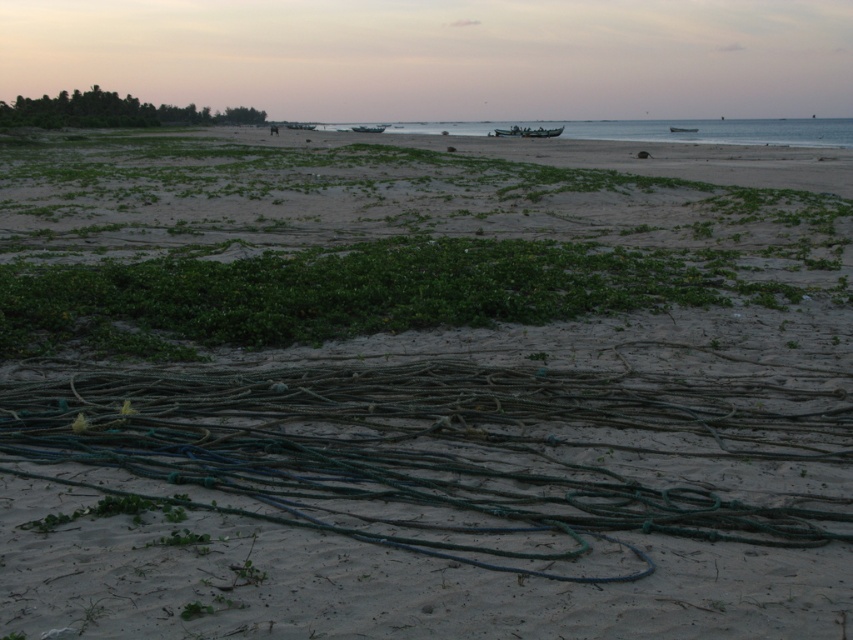
Consider the image. You are standing on the beach and see the green rubber rope at lower center and the green leafy vegetation at upper left. Which object is taller?

The green leafy vegetation at upper left is taller than the green rubber rope at lower center.

You are a beach cleaner and you need to collect all green items. You have a bag that can hold items occupying up to 1.5 cubic meters. You see the green rubber rope at lower center and the green leafy vegetation at upper left. Which item should you collect first to maximize your bag capacity?

The green rubber rope at lower center occupies less space than the green leafy vegetation at upper left, so you should collect the green leafy vegetation at upper left first to maximize your bag capacity.

You are standing on the beach looking out at the ocean. There is a clear blue water at center marked by point (712, 131). If you walk straight towards the ocean from your current position, will you reach the clear blue water at center before the shoreline?

The clear blue water at center is represented by point (712, 131), so yes, walking straight towards the ocean from your current position would lead you to the clear blue water at center before reaching the shoreline.